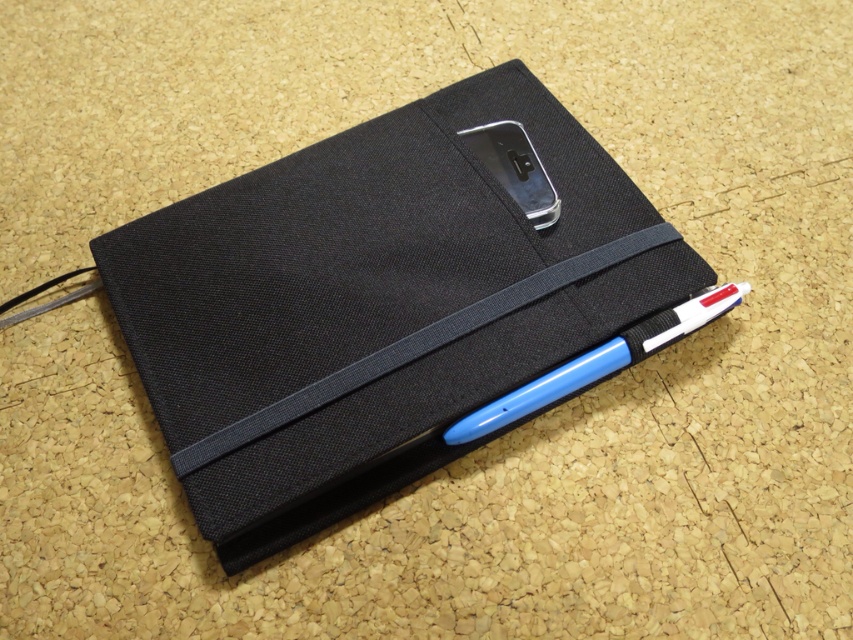
Question: Which point appears farthest from the camera in this image?

Choices:
 (A) (729, 305)
 (B) (192, 236)

Answer: (B)

Question: Which of the following is the farthest from the observer?

Choices:
 (A) black fabric notebook at center
 (B) blue plastic pen at lower right

Answer: (B)

Question: Is the position of black fabric notebook at center less distant than that of blue plastic pen at lower right?

Choices:
 (A) no
 (B) yes

Answer: (B)

Question: Does black fabric notebook at center have a larger size compared to blue plastic pen at lower right?

Choices:
 (A) no
 (B) yes

Answer: (B)

Question: Which point is closer to the camera?

Choices:
 (A) blue plastic pen at lower right
 (B) black fabric notebook at center

Answer: (B)

Question: Is black fabric notebook at center further to the viewer compared to blue plastic pen at lower right?

Choices:
 (A) no
 (B) yes

Answer: (A)